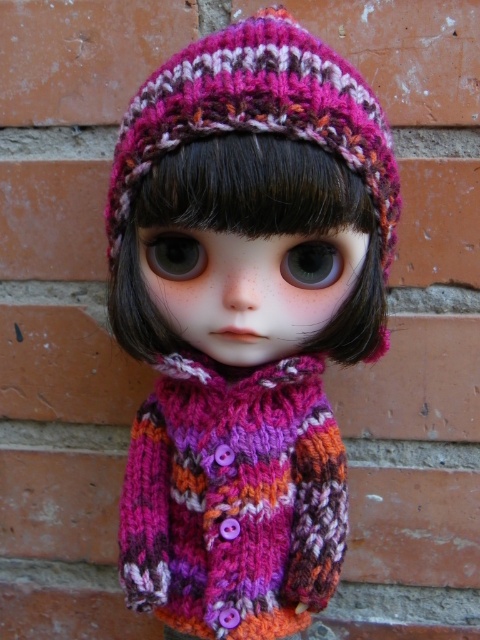
You are an interior designer arranging a display shelf. The knitted woolen sweater at center is placed at coordinates 0.505, 0.510. If you want to place a decorative item exactly 0.1 units to the right of the sweater, where would you position it?

The knitted woolen sweater at center is located at point (244,323). To place an item 0.1 units to the right, add 0.1 to the x coordinate. The new position would be (244,387).

You are a photographer setting up a shot of the doll. The camera is positioned to focus on the knitted woolen sweater at center. If the sweater is 29.71 inches away from the camera, what is the minimum distance you should set the camera lens to ensure the sweater is in focus?

The minimum distance you should set the camera lens is at least 29.71 inches to ensure the knitted woolen sweater at center is in focus since it is exactly that far away from the camera.

You are a tailor examining the doll and its outfit. You need to determine the vertical arrangement of the knitted woolen sweater at center and the knitted wool scarf at center. Which one is positioned higher on the doll?

The knitted woolen sweater at center is positioned higher than the knitted wool scarf at center.